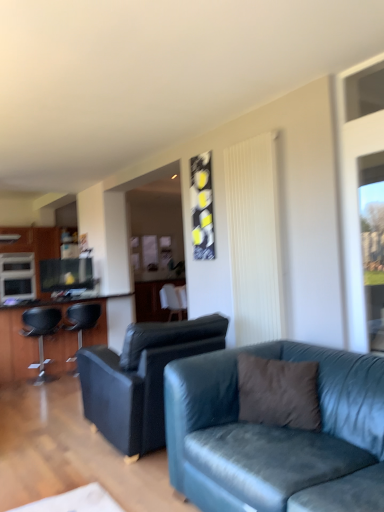
Question: Does matte black cabinet at left have a smaller size compared to white fabric chair at center, positioned as the third chair in left-to-right order?

Choices:
 (A) yes
 (B) no

Answer: (B)

Question: Is white fabric chair at center, the 3th chair positioned from the front, surrounded by matte black cabinet at left?

Choices:
 (A) no
 (B) yes

Answer: (A)

Question: Is matte black cabinet at left with white fabric chair at center, the 3th chair positioned from the front?

Choices:
 (A) yes
 (B) no

Answer: (B)

Question: From a real-world perspective, is matte black cabinet at left beneath white fabric chair at center, positioned as the third chair in left-to-right order?

Choices:
 (A) yes
 (B) no

Answer: (B)

Question: Is matte black cabinet at left positioned in front of white fabric chair at center, arranged as the 1th chair when viewed from the back?

Choices:
 (A) no
 (B) yes

Answer: (A)

Question: From the image's perspective, relative to white fabric chair at center, the first chair from the right, is velvet blue couch at center, marked as the 1th studio couch in a front-to-back arrangement, above or below?

Choices:
 (A) above
 (B) below

Answer: (B)

Question: From a real-world perspective, relative to white fabric chair at center, arranged as the 1th chair when viewed from the back, is velvet blue couch at center, marked as the 1th studio couch in a front-to-back arrangement, vertically above or below?

Choices:
 (A) below
 (B) above

Answer: (A)

Question: Looking at their shapes, would you say velvet blue couch at center, marked as the 1th studio couch in a front-to-back arrangement, is wider or thinner than white fabric chair at center, arranged as the 1th chair when viewed from the back?

Choices:
 (A) thin
 (B) wide

Answer: (B)

Question: In terms of height, does velvet blue couch at center, placed as the 2th studio couch when sorted from back to front, look taller or shorter compared to white fabric chair at center, the 3th chair positioned from the front?

Choices:
 (A) tall
 (B) short

Answer: (A)

Question: Is satin silver microwave at left in front of or behind matte black entertainment center at left in the image?

Choices:
 (A) behind
 (B) front

Answer: (A)

Question: From the image's perspective, is satin silver microwave at left above or below matte black entertainment center at left?

Choices:
 (A) above
 (B) below

Answer: (A)

Question: From their relative heights in the image, would you say satin silver microwave at left is taller or shorter than matte black entertainment center at left?

Choices:
 (A) short
 (B) tall

Answer: (A)

Question: Is satin silver microwave at left inside or outside of matte black entertainment center at left?

Choices:
 (A) outside
 (B) inside

Answer: (A)

Question: Visually, is transparent glass window at right positioned to the left or to the right of brown fuzzy pillow at center?

Choices:
 (A) right
 (B) left

Answer: (A)

Question: Would you say transparent glass window at right is inside or outside brown fuzzy pillow at center?

Choices:
 (A) outside
 (B) inside

Answer: (A)